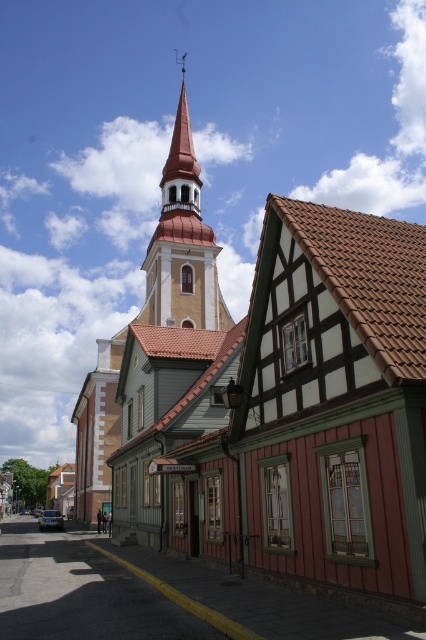
Is smooth orange steeple at center bigger than smooth orange spire at center?

Yes.

Can you confirm if smooth orange steeple at center is smaller than smooth orange spire at center?

No.

Who is more distant from viewer, (172,248) or (166,291)?

The point (172,248) is behind.

At what (x,y) coordinates should I click in order to perform the action: click on smooth orange steeple at center. Please return your answer as a coordinate pair (x, y). The image size is (426, 640). Looking at the image, I should click on (181, 244).

Is matte yellow church steeple at upper left smaller than smooth orange spire at center?

Actually, matte yellow church steeple at upper left might be larger than smooth orange spire at center.

Is point (371, 264) more distant than point (193, 260)?

No.

Where is `matte yellow church steeple at upper left`? The width and height of the screenshot is (426, 640). matte yellow church steeple at upper left is located at coordinates pyautogui.click(x=278, y=401).

Is matte yellow church steeple at upper left below smooth orange steeple at center?

Yes.

What do you see at coordinates (278, 401) in the screenshot? This screenshot has width=426, height=640. I see `matte yellow church steeple at upper left` at bounding box center [278, 401].

Identify the location of matte yellow church steeple at upper left. (278, 401).